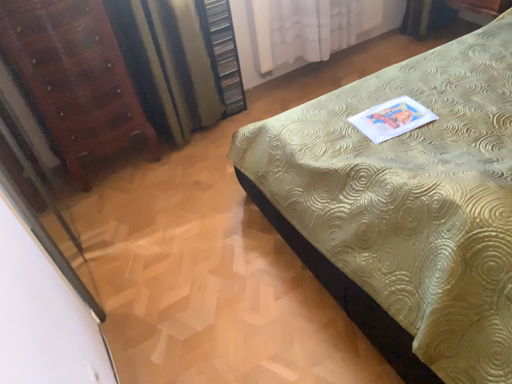
The height and width of the screenshot is (384, 512). I want to click on empty space that is to the right of mahogany wood dresser at left, so click(x=174, y=176).